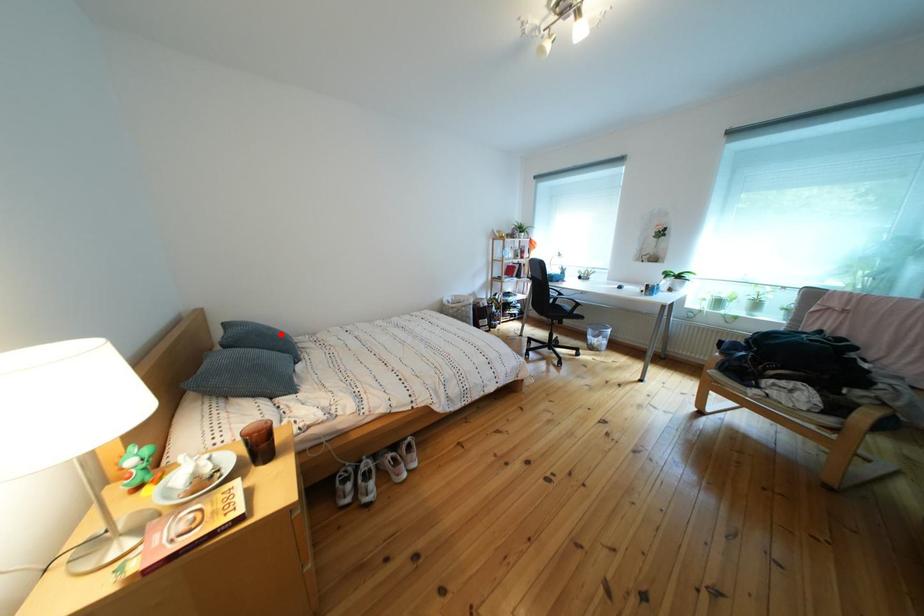
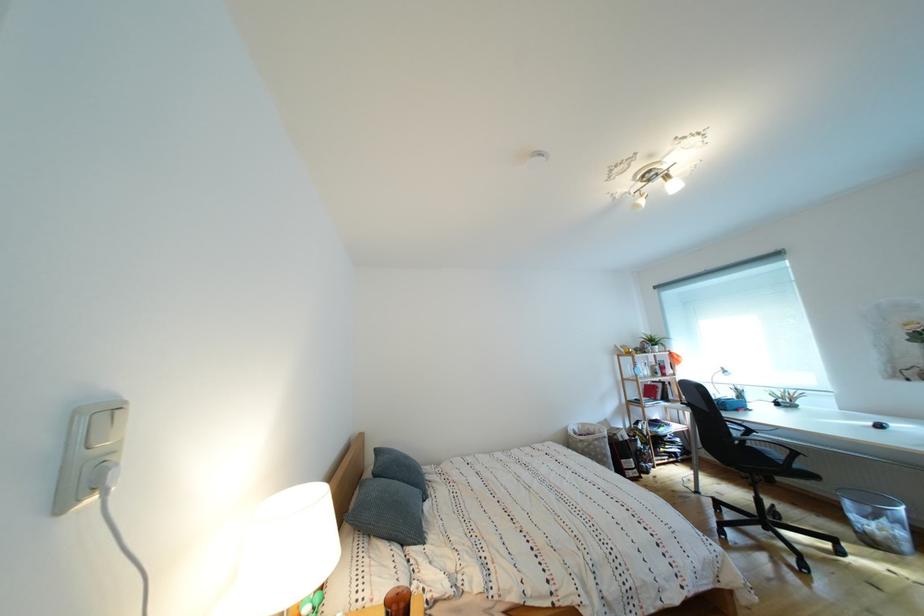
Question: I am providing you with two images of the same scene from different viewpoints. Given a red point in image1, look at the same physical point in image2. Is it:

Choices:
 (A) Closer to the viewpoint
 (B) Farther from the viewpoint

Answer: (B)